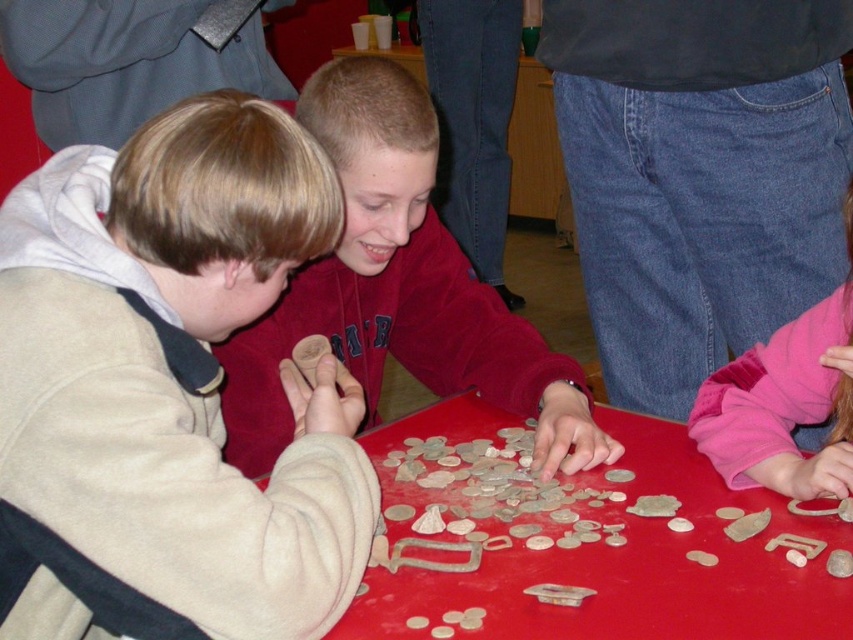
You are a photographer trying to capture a closeup of the smooth red sweater at center without including the pink fleece sleeve at lower right in the frame. Based on their positions, is this possible?

Yes, the smooth red sweater at center is above the pink fleece sleeve at lower right, so positioning the camera to focus on the sweater while angling downward could exclude the sleeve from the frame.

You are a photographer trying to capture a closeup of the smooth red sweater at center and the pink fleece sleeve at lower right. Which object should you focus on first if you want to ensure both are in focus without moving the camera?

The smooth red sweater at center is positioned on the left side of pink fleece sleeve at lower right, so you should focus on the smooth red sweater at center first since it is closer to the camera.